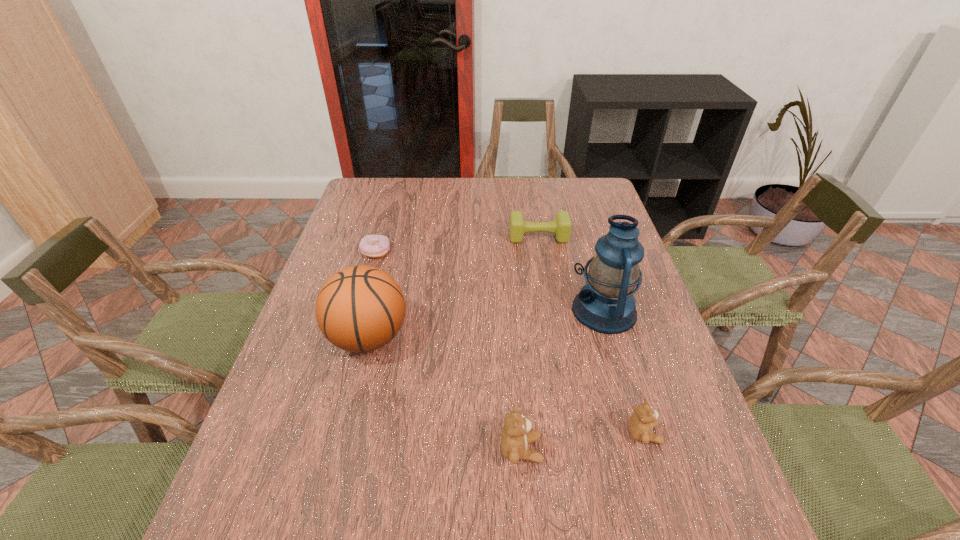
Identify the location of the left teddy bear. Image resolution: width=960 pixels, height=540 pixels. (516, 435).

Where is `the taller teddy bear`? This screenshot has width=960, height=540. the taller teddy bear is located at coordinates (516, 435).

Find the location of a particular element. the right teddy bear is located at coordinates (643, 420).

This screenshot has width=960, height=540. Find the location of `the shorter teddy bear`. the shorter teddy bear is located at coordinates (643, 420).

This screenshot has width=960, height=540. What are the coordinates of `the second shortest object` in the screenshot? It's located at (561, 226).

Identify the location of the shortest object. Image resolution: width=960 pixels, height=540 pixels. (374, 246).

You are a GUI agent. You are given a task and a screenshot of the screen. Output one action in this format:
    pyautogui.click(x=<x>, y=<y>)
    Task: Click on the lantern
    
    Given the screenshot: What is the action you would take?
    pyautogui.click(x=606, y=304)

Identify the location of basketball. The image size is (960, 540). (359, 309).

You are a GUI agent. You are given a task and a screenshot of the screen. Output one action in this format:
    pyautogui.click(x=<x>, y=<y>)
    Task: Click on the free space located 0.210m on the front-facing side of the third tallest object
    The image size is (960, 540).
    Given the screenshot: What is the action you would take?
    pyautogui.click(x=647, y=449)

Locate an element on the screen. The width and height of the screenshot is (960, 540). vacant space located 0.060m on the front-facing side of the shorter teddy bear is located at coordinates (689, 434).